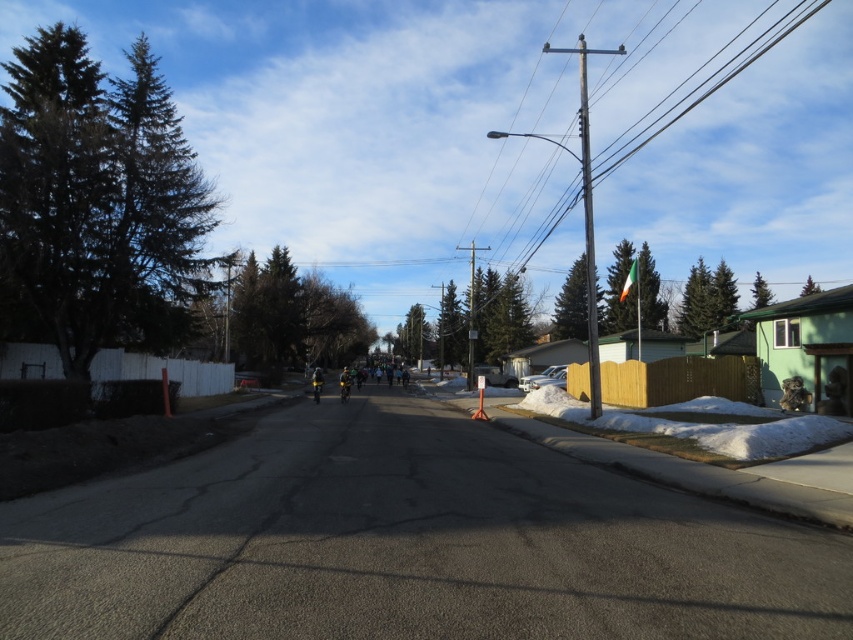
In the scene shown: You are a delivery driver who needs to park your vehicle on the suburban street. You notice the white fluffy snow at lower right and the metallic wire at upper center. Which of these two objects has a smaller width, and why?

The white fluffy snow at lower right has a smaller width than the metallic wire at upper center because the description states that the white fluffy snow at lower right has a lesser width compared to the metallic wire at upper center.